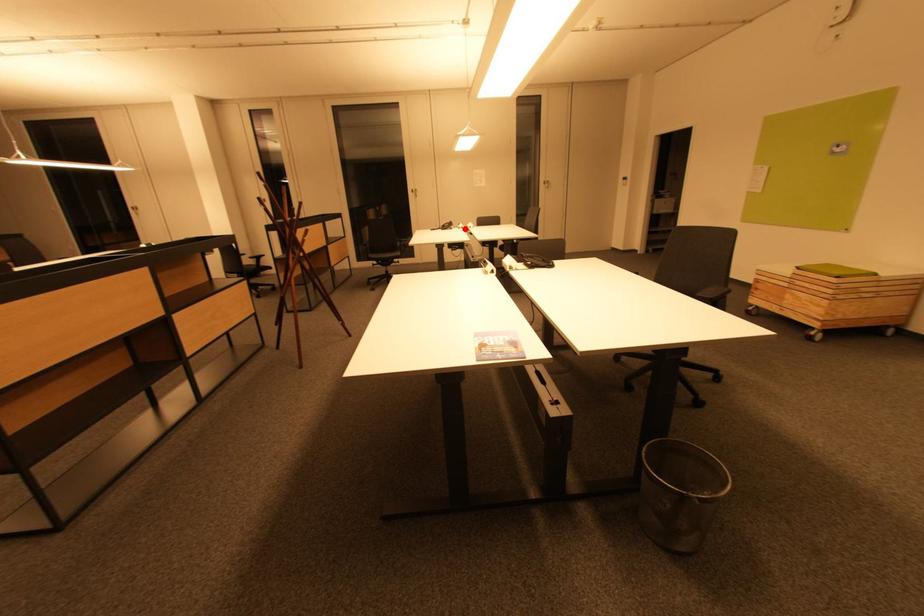
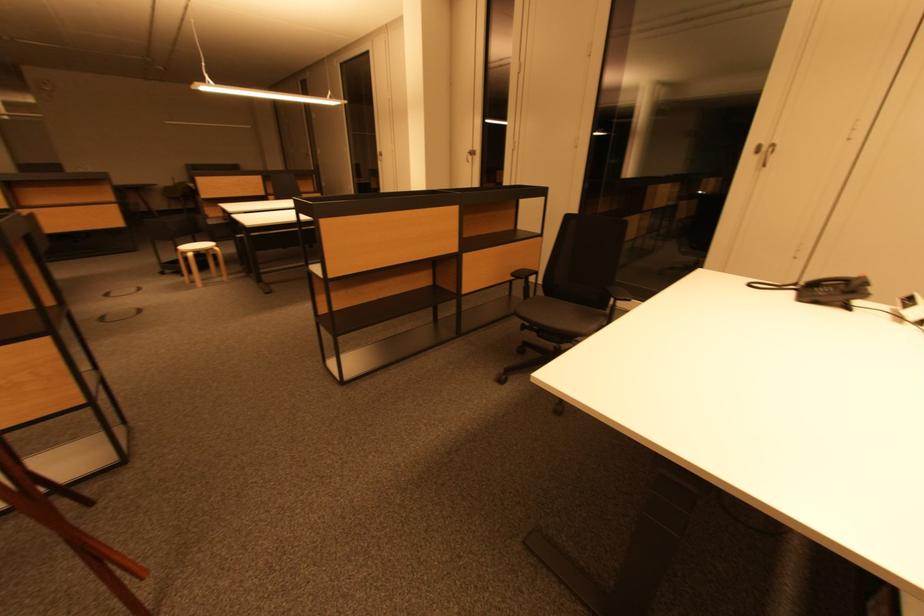
Locate, in the second image, the point that corresponds to the highlighted location in the first image.

(918, 320)